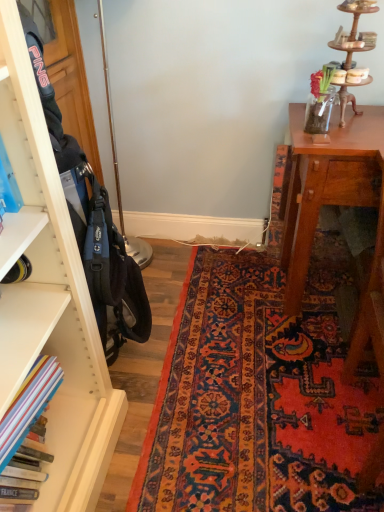
Identify the location of empty space that is ontop of carpet with intricate patterns at center (from a real-world perspective). This screenshot has height=512, width=384. (224, 396).